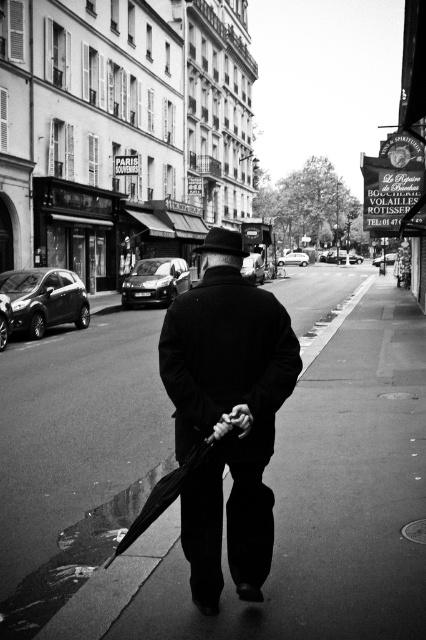
Is matte black coat at center thinner than black matte umbrella at center?

Yes, matte black coat at center is thinner than black matte umbrella at center.

Measure the distance between matte black coat at center and black matte umbrella at center.

matte black coat at center is 22.97 inches from black matte umbrella at center.

This screenshot has width=426, height=640. What are the coordinates of `matte black coat at center` in the screenshot? It's located at (227, 413).

Between point (176, 547) and point (218, 440), which one is positioned behind?

Positioned behind is point (176, 547).

Can you confirm if smooth asphalt sidewalk at center is positioned to the right of black matte umbrella at center?

Correct, you'll find smooth asphalt sidewalk at center to the right of black matte umbrella at center.

Is point (383, 614) less distant than point (152, 509)?

That is False.

This screenshot has height=640, width=426. In order to click on smooth asphalt sidewalk at center in this screenshot , I will do `click(307, 502)`.

Which of these two, smooth asphalt sidewalk at center or matte black coat at center, stands shorter?

Standing shorter between the two is matte black coat at center.

Measure the distance between smooth asphalt sidewalk at center and matte black coat at center.

The distance of smooth asphalt sidewalk at center from matte black coat at center is 13.06 meters.

Where is `smooth asphalt sidewalk at center`? smooth asphalt sidewalk at center is located at coordinates (307, 502).